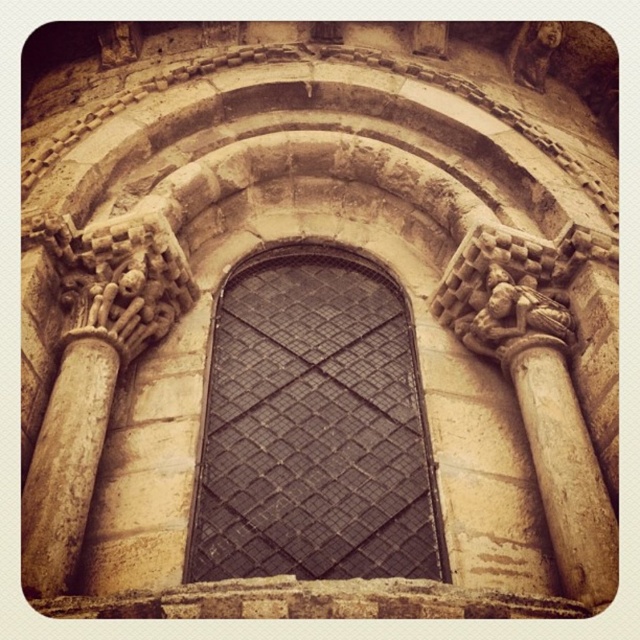
Question: Observing the image, what is the correct spatial positioning of black metal grid at center in reference to beige stone column at right?

Choices:
 (A) left
 (B) right

Answer: (A)

Question: Does black metal grid at center appear over beige stone column at right?

Choices:
 (A) yes
 (B) no

Answer: (A)

Question: Is black metal grid at center thinner than beige stone column at right?

Choices:
 (A) no
 (B) yes

Answer: (A)